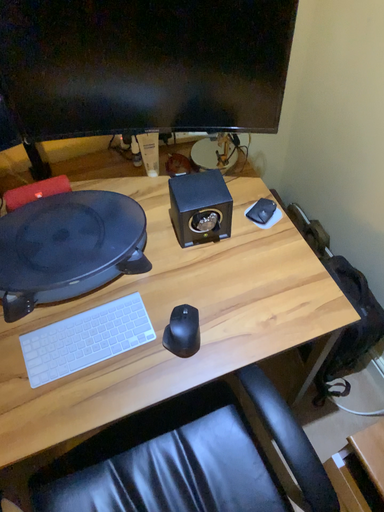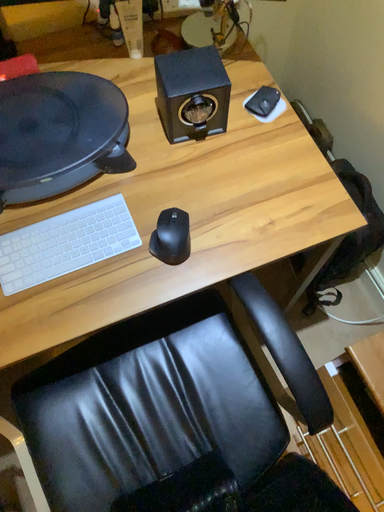
Question: How did the camera likely rotate when shooting the video?

Choices:
 (A) rotated upward
 (B) rotated downward

Answer: (B)